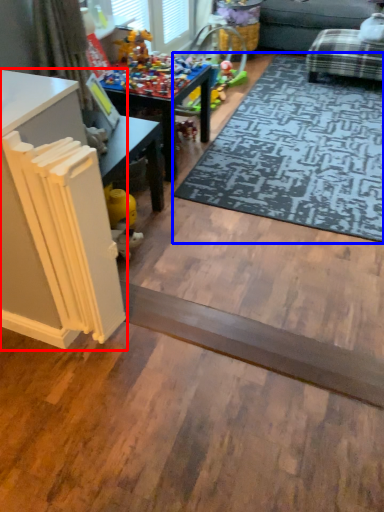
Question: Among these objects, which one is farthest to the camera, table (highlighted by a red box) or mat (highlighted by a blue box)?

Choices:
 (A) table
 (B) mat

Answer: (B)